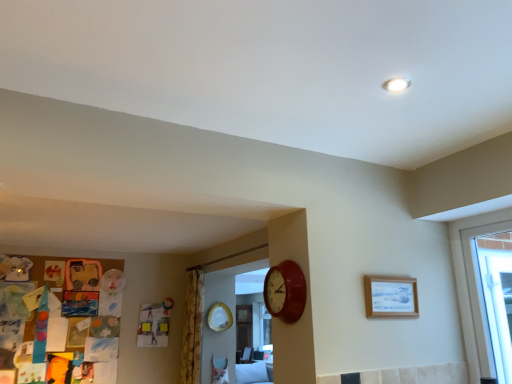
The width and height of the screenshot is (512, 384). In order to click on wooden picture frame at upper right in this screenshot , I will do `click(391, 297)`.

What do you see at coordinates (285, 291) in the screenshot? I see `matte red clock at center` at bounding box center [285, 291].

Image resolution: width=512 pixels, height=384 pixels. In order to click on wooden picture frame at upper right in this screenshot , I will do `click(391, 297)`.

Considering the relative sizes of wooden picture frame at upper right and matte red clock at center in the image provided, is wooden picture frame at upper right smaller than matte red clock at center?

Yes.

How much distance is there between wooden picture frame at upper right and matte red clock at center?

The distance of wooden picture frame at upper right from matte red clock at center is 15.13 inches.

Is point (380, 285) farther from camera compared to point (263, 289)?

That is False.

Is matte red clock at center at the back of wooden picture frame at upper right?

wooden picture frame at upper right is not turned away from matte red clock at center.

How distant is matte red clock at center from wooden picture frame at upper right?

matte red clock at center and wooden picture frame at upper right are 38.42 centimeters apart.

Is matte red clock at center not near wooden picture frame at upper right?

They are positioned close to each other.

Which is in front, matte red clock at center or wooden picture frame at upper right?

matte red clock at center is in front.

Can you confirm if matte red clock at center is positioned to the left of wooden picture frame at upper right?

Yes, matte red clock at center is to the left of wooden picture frame at upper right.

Find the location of a particular element. curtain located below the wooden picture frame at upper right (from the image's perspective) is located at coordinates (192, 328).

Does wooden picture frame at upper right have a greater width compared to yellow floral fabric curtain at center?

No, wooden picture frame at upper right is not wider than yellow floral fabric curtain at center.

Is wooden picture frame at upper right in front of or behind yellow floral fabric curtain at center in the image?

wooden picture frame at upper right is positioned closer to the viewer than yellow floral fabric curtain at center.

Is wooden picture frame at upper right looking in the opposite direction of yellow floral fabric curtain at center?

Yes, yellow floral fabric curtain at center is at the back of wooden picture frame at upper right.

Does matte red clock at center have a lesser width compared to yellow floral fabric curtain at center?

Yes, matte red clock at center is thinner than yellow floral fabric curtain at center.

Is matte red clock at center to the right of yellow floral fabric curtain at center from the viewer's perspective?

Yes, matte red clock at center is to the right of yellow floral fabric curtain at center.

Is yellow floral fabric curtain at center at the back of matte red clock at center?

matte red clock at center does not have its back to yellow floral fabric curtain at center.

Is yellow floral fabric curtain at center beside matte red clock at center?

No, yellow floral fabric curtain at center is not with matte red clock at center.

Is yellow floral fabric curtain at center further to the viewer compared to matte red clock at center?

Yes.

From a real-world perspective, is yellow floral fabric curtain at center positioned under matte red clock at center based on gravity?

Indeed, from a real-world perspective, yellow floral fabric curtain at center is positioned beneath matte red clock at center.

Is yellow floral fabric curtain at center turned away from matte red clock at center?

No.

Is yellow floral fabric curtain at center facing towards wooden picture frame at upper right?

No, yellow floral fabric curtain at center is not turned towards wooden picture frame at upper right.

From the image's perspective, which is below, yellow floral fabric curtain at center or wooden picture frame at upper right?

yellow floral fabric curtain at center is shown below in the image.

From a real-world perspective, is yellow floral fabric curtain at center physically below wooden picture frame at upper right?

Yes, from a real-world perspective, yellow floral fabric curtain at center is beneath wooden picture frame at upper right.

Is yellow floral fabric curtain at center to the right of wooden picture frame at upper right from the viewer's perspective?

No, yellow floral fabric curtain at center is not to the right of wooden picture frame at upper right.

Identify the location of wall clock located above the wooden picture frame at upper right (from the image's perspective). The width and height of the screenshot is (512, 384). (285, 291).

Find the location of a particular element. This screenshot has height=384, width=512. wall clock above the wooden picture frame at upper right (from a real-world perspective) is located at coordinates (285, 291).

Estimate the real-world distances between objects in this image. Which object is further from matte red clock at center, yellow floral fabric curtain at center or wooden picture frame at upper right?

yellow floral fabric curtain at center lies further to matte red clock at center than the other object.

When comparing their distances from wooden picture frame at upper right, does matte red clock at center or yellow floral fabric curtain at center seem further?

yellow floral fabric curtain at center is further to wooden picture frame at upper right.

From the image, which object appears to be nearer to yellow floral fabric curtain at center, wooden picture frame at upper right or matte red clock at center?

Based on the image, matte red clock at center appears to be nearer to yellow floral fabric curtain at center.

From the image, which object appears to be farther from wooden picture frame at upper right, yellow floral fabric curtain at center or matte red clock at center?

yellow floral fabric curtain at center.

From the image, which object appears to be nearer to yellow floral fabric curtain at center, matte red clock at center or wooden picture frame at upper right?

The object closer to yellow floral fabric curtain at center is matte red clock at center.

Looking at the image, which one is located further to matte red clock at center, wooden picture frame at upper right or yellow floral fabric curtain at center?

yellow floral fabric curtain at center lies further to matte red clock at center than the other object.

I want to click on picture frame positioned between matte red clock at center and yellow floral fabric curtain at center from near to far, so click(x=391, y=297).